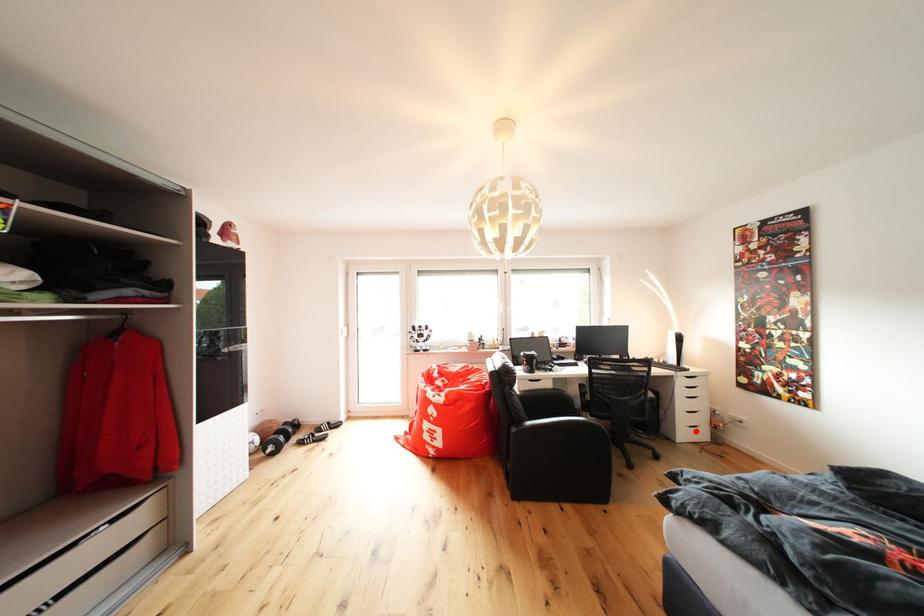
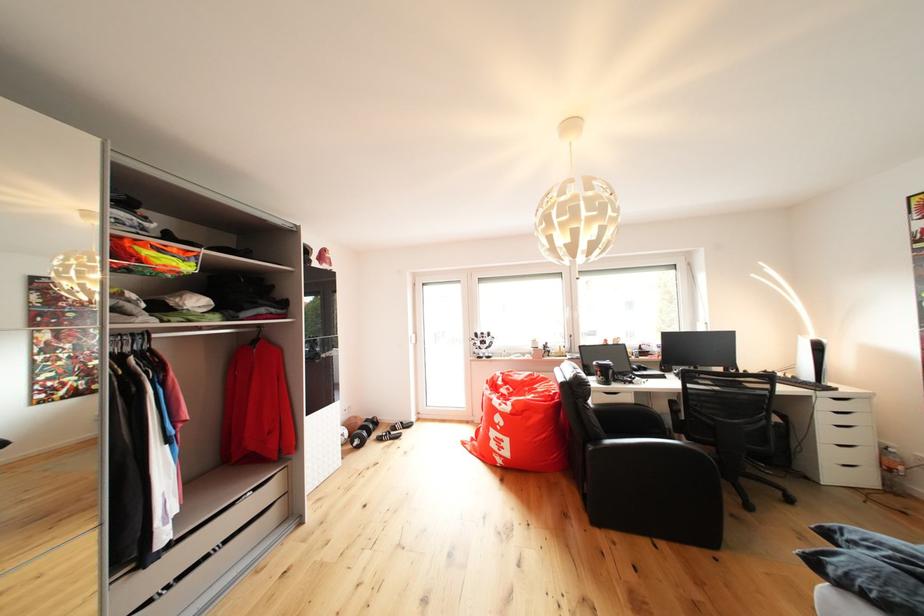
The point at the highlighted location is marked in the first image. Where is the corresponding point in the second image?

(846, 469)